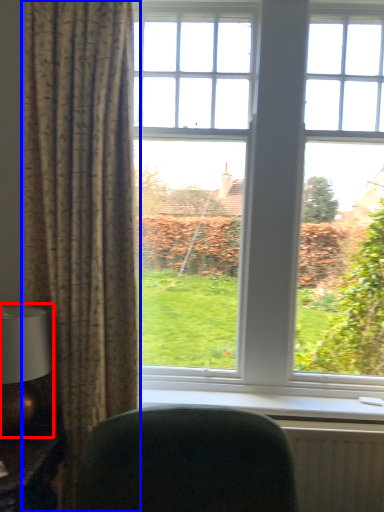
Question: Which of the following is the closest to the observer, table lamp (highlighted by a red box) or curtain (highlighted by a blue box)?

Choices:
 (A) table lamp
 (B) curtain

Answer: (A)